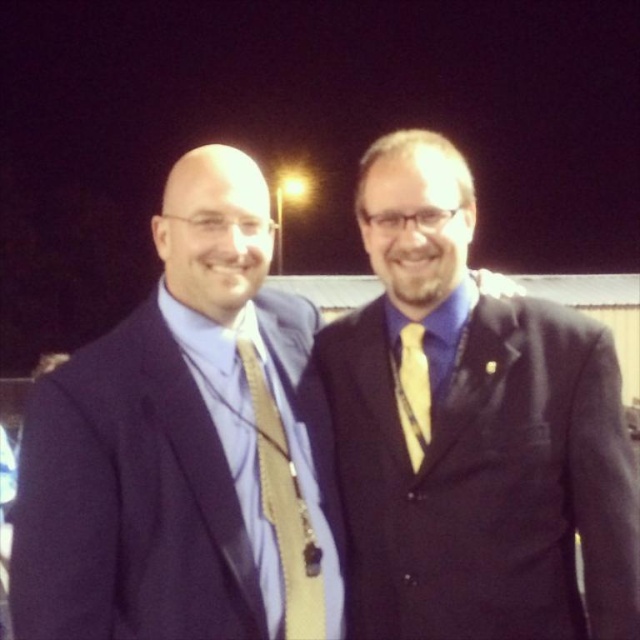
Based on the photo, measure the distance from matte blue suit at left to yellow silk tie at right.

The distance of matte blue suit at left from yellow silk tie at right is 18.89 inches.

Can you confirm if matte blue suit at left is wider than yellow silk tie at right?

Indeed, matte blue suit at left has a greater width compared to yellow silk tie at right.

Does point (189, 532) lie behind point (408, 436)?

No, (189, 532) is closer to viewer.

Where is `matte blue suit at left`? The height and width of the screenshot is (640, 640). matte blue suit at left is located at coordinates (140, 497).

Is matte black suit at right closer to the viewer compared to gold silk tie at center?

Yes.

Identify the location of matte black suit at right. The image size is (640, 640). (472, 432).

Who is more distant from viewer, (554, 435) or (145, 493)?

The point (554, 435) is more distant.

Is matte black suit at right below matte blue suit at left?

No.

Where is `matte black suit at right`? matte black suit at right is located at coordinates (472, 432).